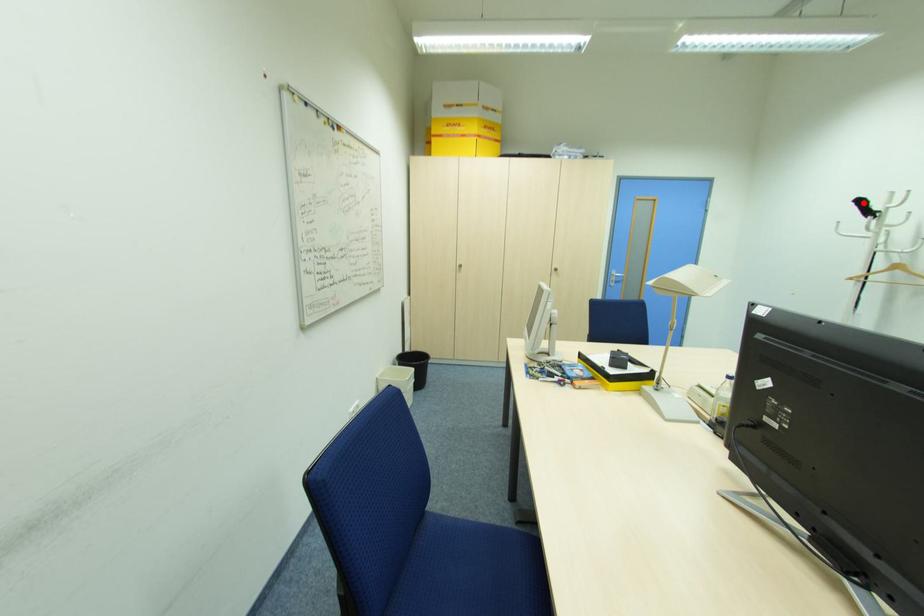
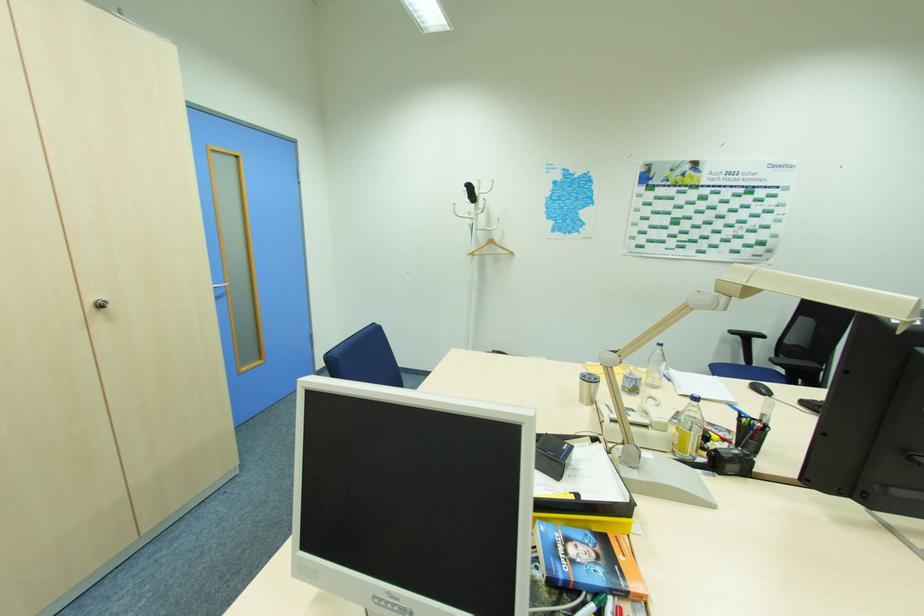
Find the pixel in the second image that matches the highlighted location in the first image.

(472, 188)